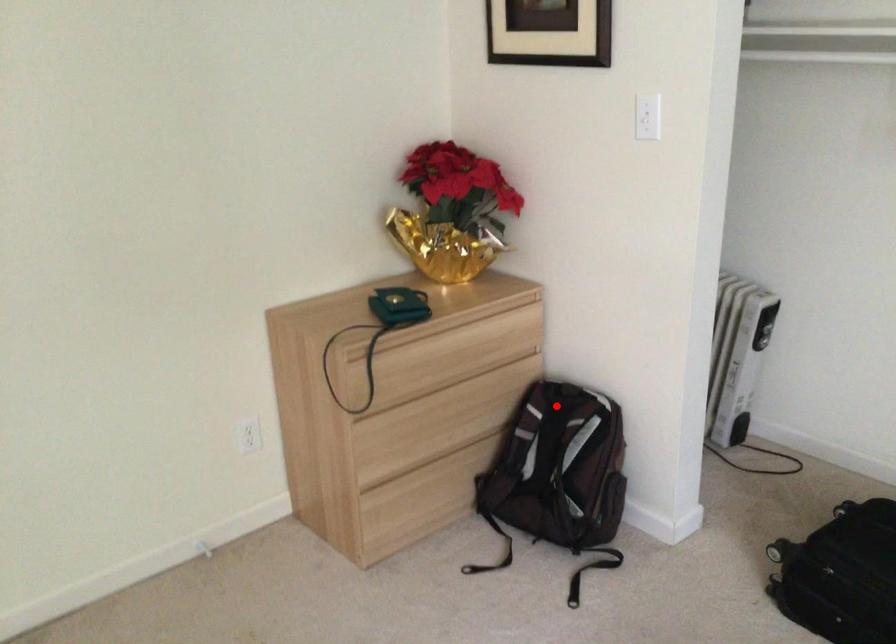
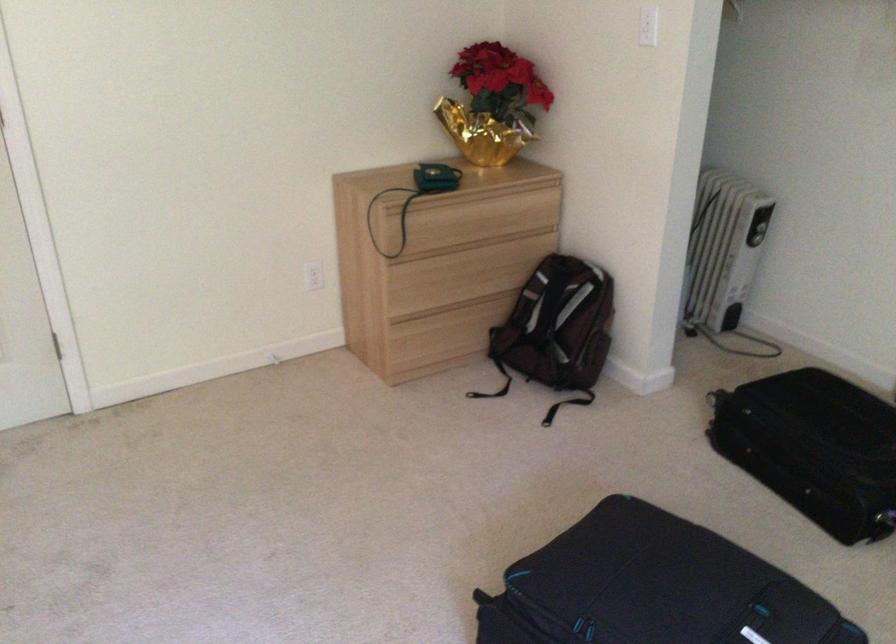
Question: I am providing you with two images of the same scene from different viewpoints. Image1 has a red point marked. In image2, the corresponding 3D location appears at what relative position? Reply with the corresponding letter.

Choices:
 (A) Closer
 (B) Farther

Answer: (B)